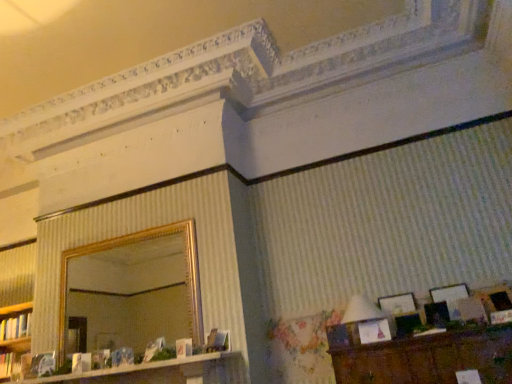
Question: From a real-world perspective, is white glossy dresser at lower left physically below matte white book at lower left, which appears as the 1th book when ordered from the bottom?

Choices:
 (A) no
 (B) yes

Answer: (B)

Question: Does white glossy dresser at lower left have a smaller size compared to matte white book at lower left, which appears as the 1th book when ordered from the bottom?

Choices:
 (A) yes
 (B) no

Answer: (B)

Question: Is white glossy dresser at lower left shorter than matte white book at lower left, which appears as the 1th book when ordered from the bottom?

Choices:
 (A) no
 (B) yes

Answer: (B)

Question: Is matte white book at lower left, which appears as the 1th book when ordered from the bottom, at the back of white glossy dresser at lower left?

Choices:
 (A) yes
 (B) no

Answer: (B)

Question: From a real-world perspective, is white glossy dresser at lower left over matte white book at lower left, the 2th book from the top?

Choices:
 (A) no
 (B) yes

Answer: (A)

Question: Considering the relative positions of white glossy dresser at lower left and matte white book at lower left, which appears as the 1th book when ordered from the bottom, in the image provided, is white glossy dresser at lower left to the left of matte white book at lower left, which appears as the 1th book when ordered from the bottom, from the viewer's perspective?

Choices:
 (A) no
 (B) yes

Answer: (A)

Question: From a real-world perspective, is white fabric lampshade at right positioned over gold-framed mirror at upper center based on gravity?

Choices:
 (A) no
 (B) yes

Answer: (A)

Question: Are white fabric lampshade at right and gold-framed mirror at upper center located far from each other?

Choices:
 (A) no
 (B) yes

Answer: (B)

Question: Could you tell me if white fabric lampshade at right is turned towards gold-framed mirror at upper center?

Choices:
 (A) yes
 (B) no

Answer: (B)

Question: Would you say white fabric lampshade at right contains gold-framed mirror at upper center?

Choices:
 (A) yes
 (B) no

Answer: (B)

Question: Does white fabric lampshade at right have a smaller size compared to gold-framed mirror at upper center?

Choices:
 (A) no
 (B) yes

Answer: (B)

Question: From the image's perspective, is white fabric lampshade at right located above gold-framed mirror at upper center?

Choices:
 (A) no
 (B) yes

Answer: (A)

Question: Is white fabric lampshade at right with matte silver picture frame at upper right, which appears as the 1th picture frame when viewed from the left?

Choices:
 (A) no
 (B) yes

Answer: (A)